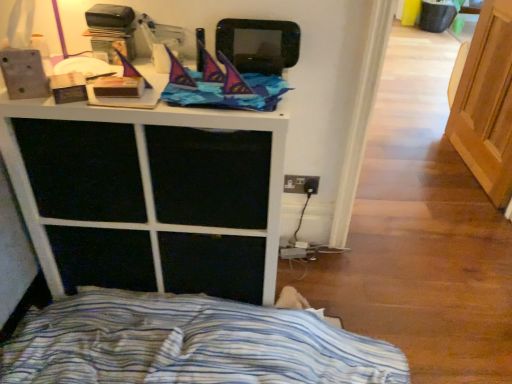
Question: Are blue striped fabric at lower left and white matte cabinet at upper center beside each other?

Choices:
 (A) no
 (B) yes

Answer: (A)

Question: Considering the relative sizes of blue striped fabric at lower left and white matte cabinet at upper center in the image provided, is blue striped fabric at lower left taller than white matte cabinet at upper center?

Choices:
 (A) yes
 (B) no

Answer: (B)

Question: From a real-world perspective, is blue striped fabric at lower left under white matte cabinet at upper center?

Choices:
 (A) no
 (B) yes

Answer: (B)

Question: Is blue striped fabric at lower left smaller than white matte cabinet at upper center?

Choices:
 (A) yes
 (B) no

Answer: (A)

Question: Can white matte cabinet at upper center be found inside blue striped fabric at lower left?

Choices:
 (A) yes
 (B) no

Answer: (B)

Question: Considering the positions of point (333, 332) and point (101, 135), is point (333, 332) closer or farther from the camera than point (101, 135)?

Choices:
 (A) farther
 (B) closer

Answer: (A)

Question: Considering the positions of blue striped fabric at lower left and white matte cabinet at upper center in the image, is blue striped fabric at lower left taller or shorter than white matte cabinet at upper center?

Choices:
 (A) short
 (B) tall

Answer: (A)

Question: Looking at their shapes, would you say blue striped fabric at lower left is wider or thinner than white matte cabinet at upper center?

Choices:
 (A) wide
 (B) thin

Answer: (B)

Question: Is blue striped fabric at lower left spatially inside white matte cabinet at upper center, or outside of it?

Choices:
 (A) inside
 (B) outside

Answer: (B)

Question: From the image's perspective, is light brown wood screen door at right positioned above or below blue striped fabric at lower left?

Choices:
 (A) below
 (B) above

Answer: (B)

Question: Is light brown wood screen door at right situated inside blue striped fabric at lower left or outside?

Choices:
 (A) inside
 (B) outside

Answer: (B)

Question: Is light brown wood screen door at right bigger or smaller than blue striped fabric at lower left?

Choices:
 (A) small
 (B) big

Answer: (A)

Question: From a real-world perspective, is light brown wood screen door at right above or below blue striped fabric at lower left?

Choices:
 (A) above
 (B) below

Answer: (A)

Question: From a real-world perspective, is white matte cabinet at upper center physically located above or below blue striped fabric at lower left?

Choices:
 (A) above
 (B) below

Answer: (A)

Question: Looking at their shapes, would you say white matte cabinet at upper center is wider or thinner than blue striped fabric at lower left?

Choices:
 (A) thin
 (B) wide

Answer: (B)